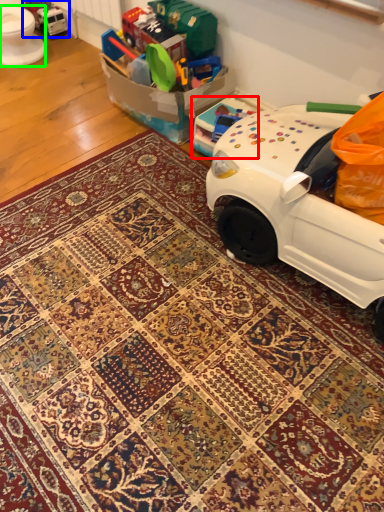
Question: Based on their relative distances, which object is farther from toy (highlighted by a red box)? Choose from toy (highlighted by a blue box) and toilet bowl (highlighted by a green box).

Choices:
 (A) toy
 (B) toilet bowl

Answer: (A)